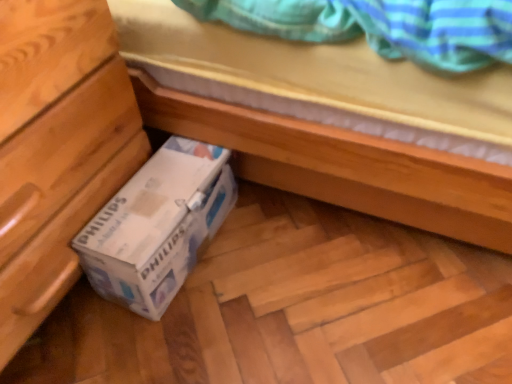
At what (x,y) coordinates should I click in order to perform the action: click on wooden chest of drawers at lower left. Please return your answer as a coordinate pair (x, y). Looking at the image, I should click on (56, 149).

What do you see at coordinates (56, 149) in the screenshot?
I see `wooden chest of drawers at lower left` at bounding box center [56, 149].

What is the approximate width of wooden chest of drawers at lower left?

The width of wooden chest of drawers at lower left is 17.36 inches.

The width and height of the screenshot is (512, 384). What do you see at coordinates (158, 226) in the screenshot?
I see `white cardboard box at lower left` at bounding box center [158, 226].

Where is `white cardboard box at lower left`? white cardboard box at lower left is located at coordinates (158, 226).

This screenshot has width=512, height=384. Find the location of `wooden chest of drawers at lower left`. wooden chest of drawers at lower left is located at coordinates (56, 149).

Is wooden chest of drawers at lower left to the left of white cardboard box at lower left from the viewer's perspective?

Yes, wooden chest of drawers at lower left is to the left of white cardboard box at lower left.

Which object is closer to the camera, wooden chest of drawers at lower left or white cardboard box at lower left?

wooden chest of drawers at lower left is more forward.

Which is farther from the camera, (95,29) or (88,253)?

The point (88,253) is more distant.

From the image's perspective, is wooden chest of drawers at lower left under white cardboard box at lower left?

No, from the image's perspective, wooden chest of drawers at lower left is not below white cardboard box at lower left.

From a real-world perspective, which object stands above the other?

wooden chest of drawers at lower left.

Considering the sizes of wooden chest of drawers at lower left and white cardboard box at lower left in the image, is wooden chest of drawers at lower left wider or thinner than white cardboard box at lower left?

wooden chest of drawers at lower left is wider than white cardboard box at lower left.

Considering the sizes of wooden chest of drawers at lower left and white cardboard box at lower left in the image, is wooden chest of drawers at lower left taller or shorter than white cardboard box at lower left?

Considering their sizes, wooden chest of drawers at lower left has more height than white cardboard box at lower left.

Is wooden chest of drawers at lower left bigger than white cardboard box at lower left?

Indeed, wooden chest of drawers at lower left has a larger size compared to white cardboard box at lower left.

Can we say wooden chest of drawers at lower left lies outside white cardboard box at lower left?

Yes, wooden chest of drawers at lower left is located beyond the bounds of white cardboard box at lower left.

Are wooden chest of drawers at lower left and white cardboard box at lower left located far from each other?

Actually, wooden chest of drawers at lower left and white cardboard box at lower left are a little close together.

Is wooden chest of drawers at lower left aimed at white cardboard box at lower left?

Yes, wooden chest of drawers at lower left is oriented towards white cardboard box at lower left.

Find the location of a particular element. Image resolution: width=512 pixels, height=384 pixels. box beneath the wooden chest of drawers at lower left (from a real-world perspective) is located at coordinates (158, 226).

Does white cardboard box at lower left appear on the right side of wooden chest of drawers at lower left?

Yes, white cardboard box at lower left is to the right of wooden chest of drawers at lower left.

Does white cardboard box at lower left lie in front of wooden chest of drawers at lower left?

That is False.

Considering the positions of points (145, 266) and (51, 13), is point (145, 266) farther from camera compared to point (51, 13)?

That is True.

From the image's perspective, is white cardboard box at lower left positioned above or below wooden chest of drawers at lower left?

Clearly, from the image's perspective, white cardboard box at lower left is below wooden chest of drawers at lower left.

From a real-world perspective, is white cardboard box at lower left below wooden chest of drawers at lower left?

Correct, in the physical world, white cardboard box at lower left is lower than wooden chest of drawers at lower left.

Does white cardboard box at lower left have a lesser width compared to wooden chest of drawers at lower left?

Yes, white cardboard box at lower left is thinner than wooden chest of drawers at lower left.

Can you confirm if white cardboard box at lower left is shorter than wooden chest of drawers at lower left?

Yes.

Can you confirm if white cardboard box at lower left is smaller than wooden chest of drawers at lower left?

Yes, white cardboard box at lower left is smaller than wooden chest of drawers at lower left.

Is white cardboard box at lower left inside the boundaries of wooden chest of drawers at lower left, or outside?

white cardboard box at lower left is spatially situated outside wooden chest of drawers at lower left.

Are white cardboard box at lower left and wooden chest of drawers at lower left making contact?

No, white cardboard box at lower left is not in contact with wooden chest of drawers at lower left.

Is white cardboard box at lower left turned away from wooden chest of drawers at lower left?

Yes, white cardboard box at lower left is facing away from wooden chest of drawers at lower left.

What's the angular difference between white cardboard box at lower left and wooden chest of drawers at lower left's facing directions?

There is a 2.2-degree angle between the facing directions of white cardboard box at lower left and wooden chest of drawers at lower left.

In the image, there is a white cardboard box at lower left. At what (x,y) coordinates should I click in order to perform the action: click on the chest of drawers above it (from the image's perspective). Please return your answer as a coordinate pair (x, y). This screenshot has height=384, width=512. Looking at the image, I should click on (56, 149).

Locate an element on the screen. box behind the wooden chest of drawers at lower left is located at coordinates (158, 226).

The width and height of the screenshot is (512, 384). I want to click on the chest of drawers located above the white cardboard box at lower left (from the image's perspective), so point(56,149).